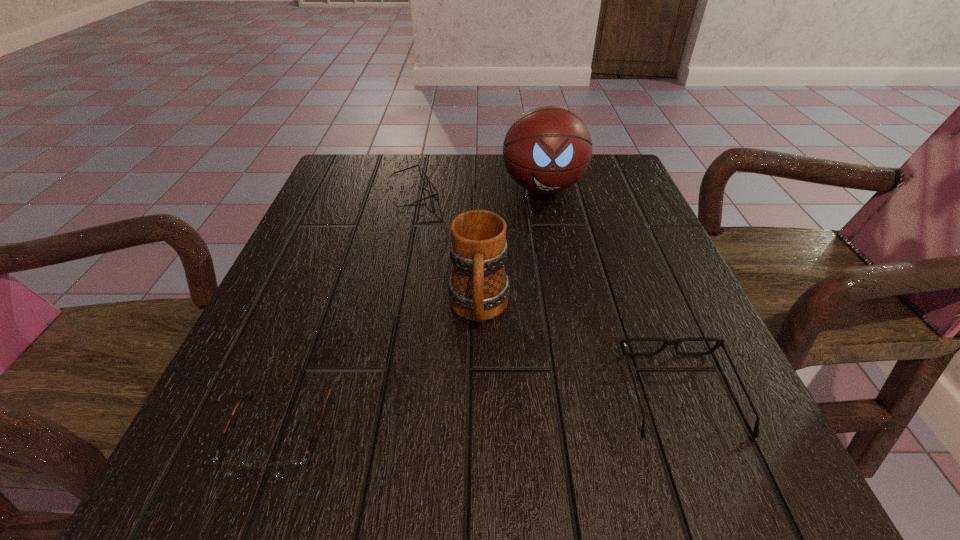
Choose which object is the third nearest neighbor to the farthest spectacles. Please provide its 2D coordinates. Your answer should be formatted as a tuple, i.e. [(x, y)], where the tuple contains the x and y coordinates of a point satisfying the conditions above.

[(288, 469)]

At what (x,y) coordinates should I click in order to perform the action: click on object that is the second closest to the third object from right to left. Please return your answer as a coordinate pair (x, y). This screenshot has width=960, height=540. Looking at the image, I should click on (288, 469).

Point out which spectacles is positioned as the second nearest to the basketball. Please provide its 2D coordinates. Your answer should be formatted as a tuple, i.e. [(x, y)], where the tuple contains the x and y coordinates of a point satisfying the conditions above.

[(719, 342)]

Choose which spectacles is the second nearest neighbor to the rightmost spectacles. Please provide its 2D coordinates. Your answer should be formatted as a tuple, i.e. [(x, y)], where the tuple contains the x and y coordinates of a point satisfying the conditions above.

[(422, 174)]

I want to click on free location that satisfies the following two spatial constraints: 1. on the front-facing side of the rightmost spectacles; 2. with the lenses facing outward on the farthest spectacles, so click(604, 195).

Where is `blank area in the image that satisfies the following two spatial constraints: 1. with the lenses facing outward on the farthest spectacles; 2. on the front-facing side of the rightmost spectacles`? blank area in the image that satisfies the following two spatial constraints: 1. with the lenses facing outward on the farthest spectacles; 2. on the front-facing side of the rightmost spectacles is located at coordinates (374, 393).